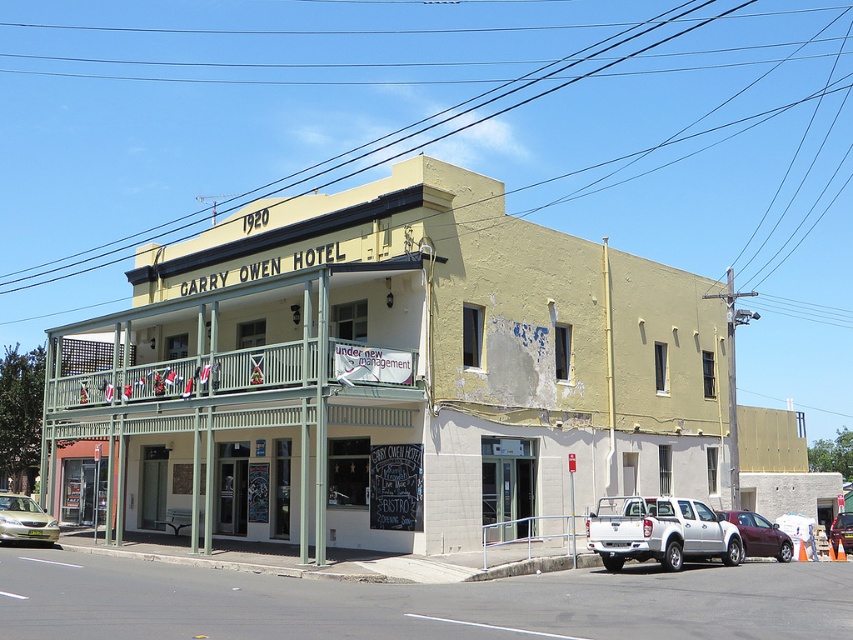
Does point (381, 225) come farther from viewer compared to point (753, 528)?

No.

Does yellow painted building at center appear on the right side of maroon metallic sedan at lower right?

Yes, yellow painted building at center is to the right of maroon metallic sedan at lower right.

Is point (138, 465) positioned after point (769, 524)?

That is True.

Identify the location of yellow painted building at center. This screenshot has width=853, height=640. (410, 380).

Can you confirm if silver metallic pickup truck at lower right is smaller than maroon metallic sedan at lower right?

Yes.

This screenshot has width=853, height=640. What are the coordinates of `silver metallic pickup truck at lower right` in the screenshot? It's located at click(x=659, y=531).

What are the coordinates of `silver metallic pickup truck at lower right` in the screenshot? It's located at (659, 531).

Who is taller, yellow painted building at center or silver metallic sedan at lower left?

yellow painted building at center is taller.

Which is below, yellow painted building at center or silver metallic sedan at lower left?

Positioned lower is silver metallic sedan at lower left.

Is point (451, 438) positioned before point (35, 518)?

Yes, it is.

This screenshot has width=853, height=640. In order to click on yellow painted building at center in this screenshot , I will do `click(410, 380)`.